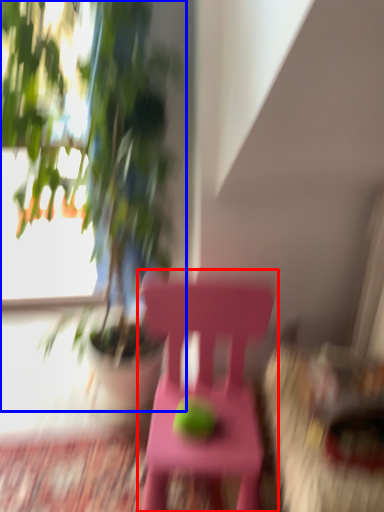
Question: Among these objects, which one is nearest to the camera, chair (highlighted by a red box) or houseplant (highlighted by a blue box)?

Choices:
 (A) chair
 (B) houseplant

Answer: (B)